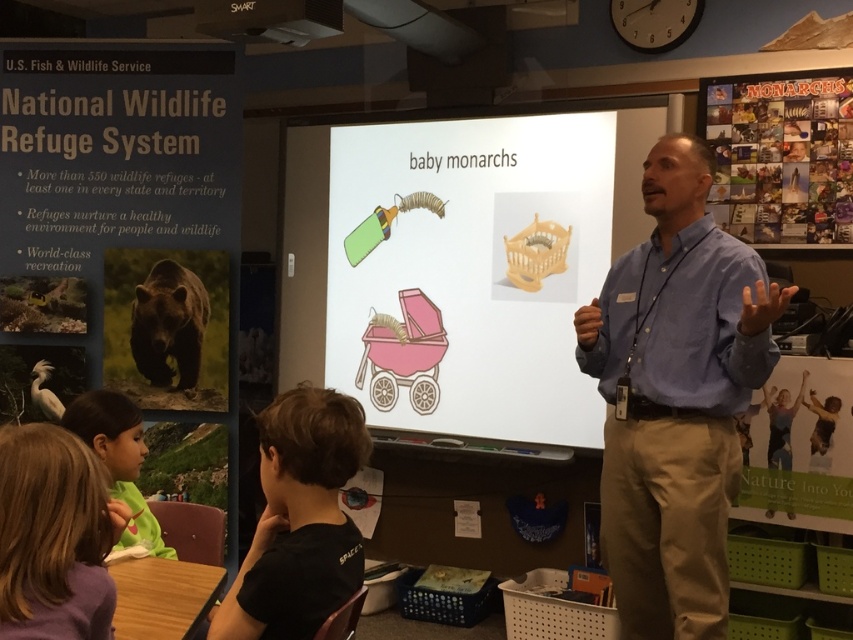
Does matte plastic stroller at center appear over pink paper baby carriage at center?

Yes, matte plastic stroller at center is above pink paper baby carriage at center.

Who is more distant from viewer, (566, 252) or (380, 317)?

Positioned behind is point (380, 317).

Locate an element on the screen. This screenshot has height=640, width=853. matte plastic stroller at center is located at coordinates (461, 266).

Is black cotton shirt at lower left further to the viewer compared to light brown hair at lower left?

That is False.

Does black cotton shirt at lower left have a smaller size compared to light brown hair at lower left?

Yes, black cotton shirt at lower left is smaller than light brown hair at lower left.

Who is more distant from viewer, (323,589) or (109,416)?

The point (109,416) is behind.

You are a GUI agent. You are given a task and a screenshot of the screen. Output one action in this format:
    pyautogui.click(x=<x>, y=<y>)
    Task: Click on the black cotton shirt at lower left
    
    Given the screenshot: What is the action you would take?
    pyautogui.click(x=299, y=518)

Who is more distant from viewer, (648, 560) or (16, 509)?

The point (648, 560) is more distant.

Who is lower down, blue shirt at center or smooth brown hair at lower left?

smooth brown hair at lower left

Who is more forward, (668, 460) or (88, 483)?

Point (88, 483) is in front.

This screenshot has width=853, height=640. In order to click on blue shirt at center in this screenshot , I will do `click(675, 397)`.